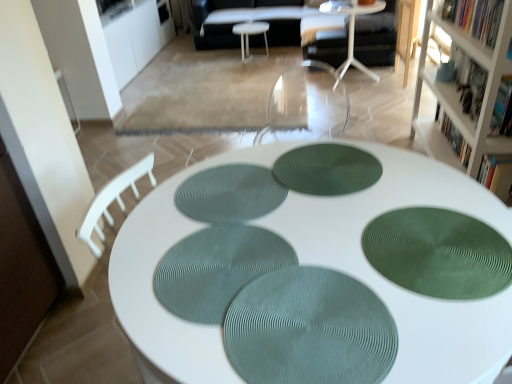
Identify the location of vacant space positioned to the left of green textured placemat at center. Image resolution: width=512 pixels, height=384 pixels. (180, 306).